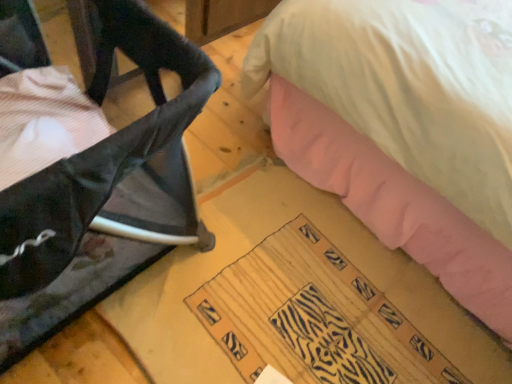
Image resolution: width=512 pixels, height=384 pixels. Find the location of `free space to the back side of zebra-patterned fabric at lower center`. free space to the back side of zebra-patterned fabric at lower center is located at coordinates (298, 207).